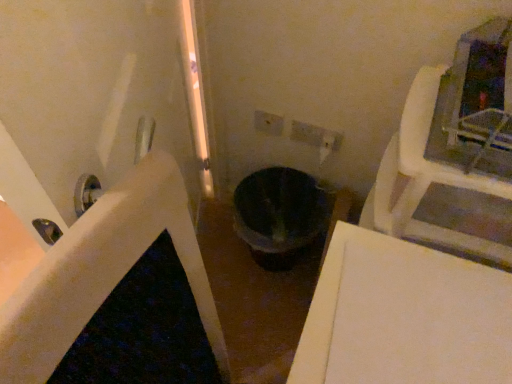
Question: Is black glossy bath at center in contact with black matte toilet bowl at center?

Choices:
 (A) yes
 (B) no

Answer: (B)

Question: Is black glossy bath at center surrounding black matte toilet bowl at center?

Choices:
 (A) no
 (B) yes

Answer: (A)

Question: Is black glossy bath at center thinner than black matte toilet bowl at center?

Choices:
 (A) yes
 (B) no

Answer: (B)

Question: Can you confirm if black glossy bath at center is shorter than black matte toilet bowl at center?

Choices:
 (A) yes
 (B) no

Answer: (A)

Question: From the image's perspective, would you say black glossy bath at center is positioned over black matte toilet bowl at center?

Choices:
 (A) yes
 (B) no

Answer: (B)

Question: Is black glossy bath at center positioned far away from black matte toilet bowl at center?

Choices:
 (A) no
 (B) yes

Answer: (A)

Question: Are black matte toilet bowl at center and black glossy bath at center far apart?

Choices:
 (A) no
 (B) yes

Answer: (A)

Question: Can you confirm if black matte toilet bowl at center is positioned to the right of black glossy bath at center?

Choices:
 (A) yes
 (B) no

Answer: (A)

Question: Does black matte toilet bowl at center have a larger size compared to black glossy bath at center?

Choices:
 (A) no
 (B) yes

Answer: (A)

Question: Considering the relative sizes of black matte toilet bowl at center and black glossy bath at center in the image provided, is black matte toilet bowl at center wider than black glossy bath at center?

Choices:
 (A) yes
 (B) no

Answer: (B)

Question: Is black matte toilet bowl at center looking in the opposite direction of black glossy bath at center?

Choices:
 (A) yes
 (B) no

Answer: (B)

Question: Can you see black matte toilet bowl at center touching black glossy bath at center?

Choices:
 (A) yes
 (B) no

Answer: (B)

Question: Can you confirm if white plastic electric outlet at center is taller than black matte toilet bowl at center?

Choices:
 (A) no
 (B) yes

Answer: (A)